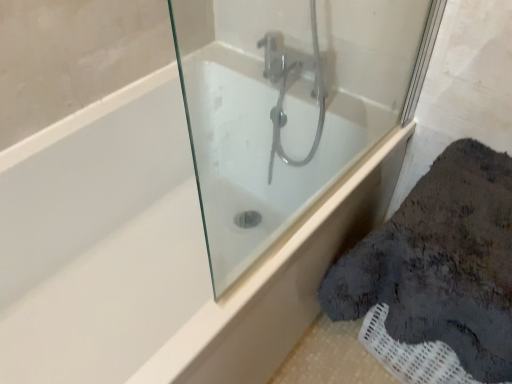
Describe the element at coordinates (260, 155) in the screenshot. I see `white glossy bathtub at center` at that location.

At what (x,y) coordinates should I click in order to perform the action: click on white glossy bathtub at center. Please return your answer as a coordinate pair (x, y). The width and height of the screenshot is (512, 384). Looking at the image, I should click on (260, 155).

You are a GUI agent. You are given a task and a screenshot of the screen. Output one action in this format:
    pyautogui.click(x=<x>, y=<y>)
    Task: Click on the white glossy bathtub at center
    The height and width of the screenshot is (384, 512).
    Given the screenshot: What is the action you would take?
    pyautogui.click(x=144, y=252)

What do you see at coordinates (144, 252) in the screenshot?
I see `white glossy bathtub at center` at bounding box center [144, 252].

Find the location of a particular element. white glossy bathtub at center is located at coordinates (260, 155).

Which is more to the right, white glossy bathtub at center or white glossy bathtub at center?

white glossy bathtub at center is more to the right.

Which object is more forward, white glossy bathtub at center or white glossy bathtub at center?

white glossy bathtub at center.

Considering the points (260, 185) and (58, 176), which point is in front, point (260, 185) or point (58, 176)?

The point (260, 185) is in front.

From the image's perspective, is white glossy bathtub at center positioned above or below white glossy bathtub at center?

Clearly, from the image's perspective, white glossy bathtub at center is above white glossy bathtub at center.

From a real-world perspective, is white glossy bathtub at center physically below white glossy bathtub at center?

Incorrect, from a real-world perspective, white glossy bathtub at center is higher than white glossy bathtub at center.

Considering the sizes of objects white glossy bathtub at center and white glossy bathtub at center in the image provided, who is wider, white glossy bathtub at center or white glossy bathtub at center?

With larger width is white glossy bathtub at center.

In terms of height, does white glossy bathtub at center look taller or shorter compared to white glossy bathtub at center?

white glossy bathtub at center is shorter than white glossy bathtub at center.

Considering the sizes of objects white glossy bathtub at center and white glossy bathtub at center in the image provided, who is bigger, white glossy bathtub at center or white glossy bathtub at center?

With larger size is white glossy bathtub at center.

Is white glossy bathtub at center completely or partially inside white glossy bathtub at center?

No, white glossy bathtub at center is not inside white glossy bathtub at center.

Can you see white glossy bathtub at center touching white glossy bathtub at center?

No, white glossy bathtub at center is not next to white glossy bathtub at center.

Is white glossy bathtub at center at the back of white glossy bathtub at center?

No, white glossy bathtub at center is not facing away from white glossy bathtub at center.

What's the angular difference between white glossy bathtub at center and white glossy bathtub at center's facing directions?

The angular difference between white glossy bathtub at center and white glossy bathtub at center is 0.81 degrees.

Measure the distance between white glossy bathtub at center and white glossy bathtub at center.

A distance of 12.00 inches exists between white glossy bathtub at center and white glossy bathtub at center.

Locate an element on the screen. The width and height of the screenshot is (512, 384). bath above the white glossy bathtub at center (from a real-world perspective) is located at coordinates [x=260, y=155].

Which is more to the left, white glossy bathtub at center or white glossy bathtub at center?

From the viewer's perspective, white glossy bathtub at center appears more on the left side.

In the image, is white glossy bathtub at center positioned in front of or behind white glossy bathtub at center?

white glossy bathtub at center is positioned farther from the viewer than white glossy bathtub at center.

Which is closer to the camera, (71, 138) or (246, 195)?

Point (71, 138) is closer to the camera than point (246, 195).

From the image's perspective, which one is positioned lower, white glossy bathtub at center or white glossy bathtub at center?

white glossy bathtub at center is shown below in the image.

From a real-world perspective, is white glossy bathtub at center on top of white glossy bathtub at center?

No, from a real-world perspective, white glossy bathtub at center is not above white glossy bathtub at center.

Between white glossy bathtub at center and white glossy bathtub at center, which one has smaller width?

Thinner between the two is white glossy bathtub at center.

Considering the relative sizes of white glossy bathtub at center and white glossy bathtub at center in the image provided, is white glossy bathtub at center shorter than white glossy bathtub at center?

In fact, white glossy bathtub at center may be taller than white glossy bathtub at center.

Does white glossy bathtub at center have a larger size compared to white glossy bathtub at center?

Correct, white glossy bathtub at center is larger in size than white glossy bathtub at center.

Is white glossy bathtub at center completely or partially outside of white glossy bathtub at center?

white glossy bathtub at center lies outside white glossy bathtub at center's area.

In the scene shown: Is white glossy bathtub at center next to white glossy bathtub at center?

No, white glossy bathtub at center is not beside white glossy bathtub at center.

Consider the image. Could you tell me if white glossy bathtub at center is facing white glossy bathtub at center?

No.

What's the angular difference between white glossy bathtub at center and white glossy bathtub at center's facing directions?

The facing directions of white glossy bathtub at center and white glossy bathtub at center are 0.81 degrees apart.

This screenshot has width=512, height=384. I want to click on bathtub that appears below the white glossy bathtub at center (from a real-world perspective), so click(x=144, y=252).

Locate an element on the screen. This screenshot has width=512, height=384. bathtub that appears behind the white glossy bathtub at center is located at coordinates (144, 252).

This screenshot has height=384, width=512. I want to click on bath above the white glossy bathtub at center (from a real-world perspective), so click(260, 155).